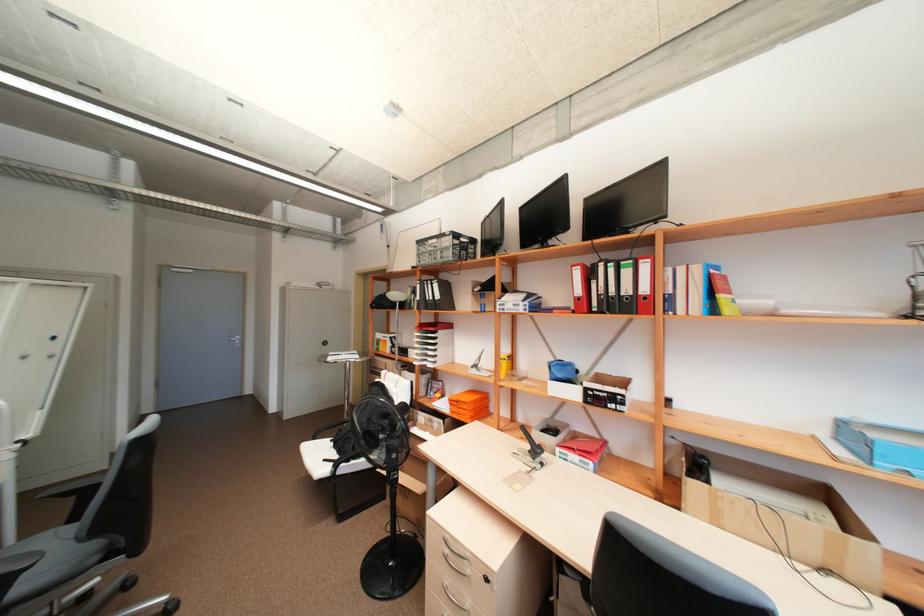
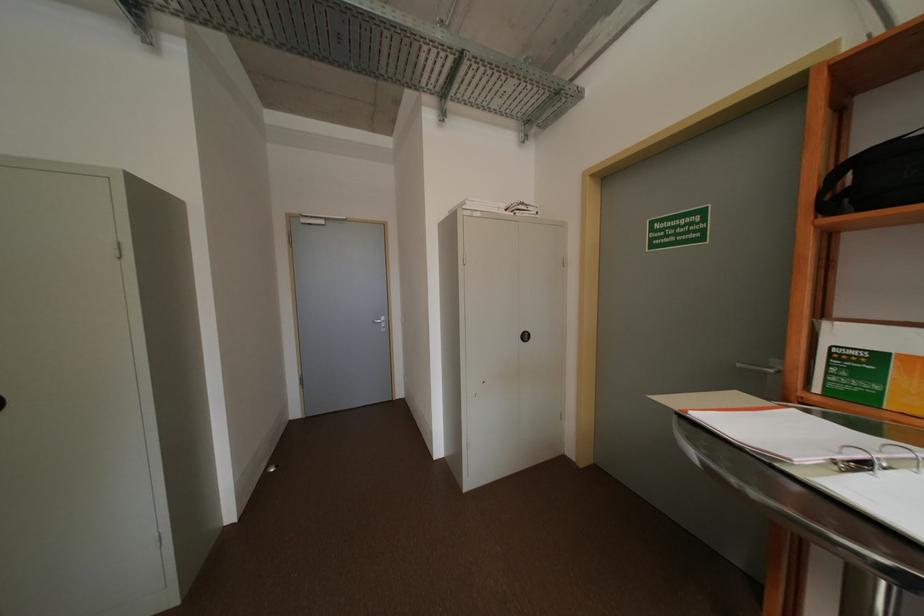
In a continuous first-person perspective shot, in which direction is the camera moving?

The cameraman moved toward left, forward.